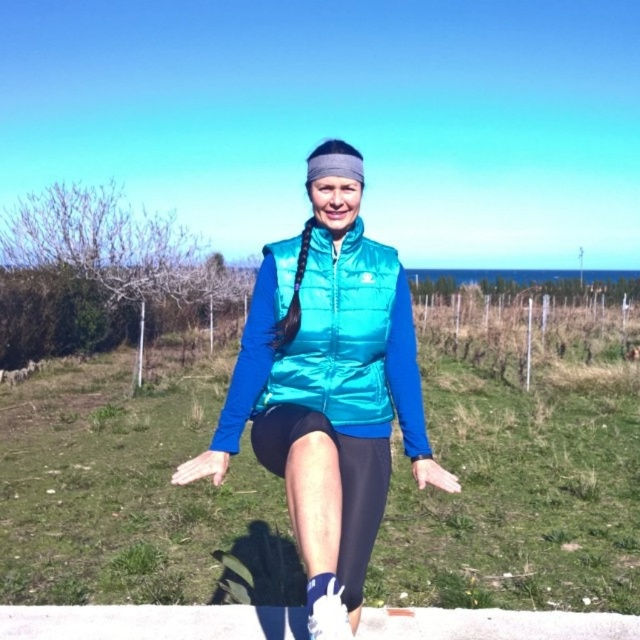
In the scene shown: Is metallic teal vest at center below black spandex leggings at center?

Actually, metallic teal vest at center is above black spandex leggings at center.

Looking at this image, does metallic teal vest at center have a greater width compared to black spandex leggings at center?

Yes.

The image size is (640, 640). I want to click on metallic teal vest at center, so click(326, 385).

Does teal quilted vest at center have a lesser width compared to black spandex leggings at center?

No.

Which of these two, teal quilted vest at center or black spandex leggings at center, stands shorter?

Standing shorter between the two is black spandex leggings at center.

Does point (369, 417) come behind point (369, 502)?

Yes, it is behind point (369, 502).

Where is `teal quilted vest at center`? The width and height of the screenshot is (640, 640). teal quilted vest at center is located at coordinates (330, 342).

From the picture: Does metallic teal vest at center appear over teal quilted vest at center?

No.

You are a GUI agent. You are given a task and a screenshot of the screen. Output one action in this format:
    pyautogui.click(x=<x>, y=<y>)
    Task: Click on the metallic teal vest at center
    
    Given the screenshot: What is the action you would take?
    pyautogui.click(x=326, y=385)

At what (x,y) coordinates should I click in order to perform the action: click on metallic teal vest at center. Please return your answer as a coordinate pair (x, y). This screenshot has height=640, width=640. Looking at the image, I should click on (326, 385).